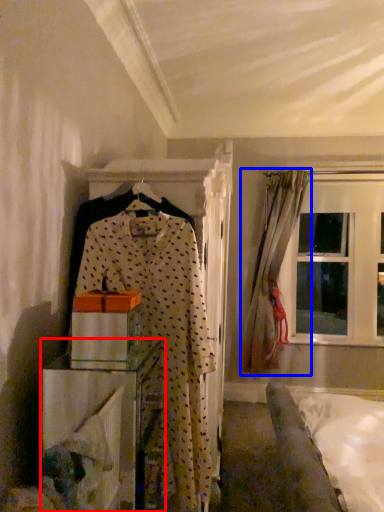
Question: Among these objects, which one is farthest to the camera, furniture (highlighted by a red box) or curtain (highlighted by a blue box)?

Choices:
 (A) furniture
 (B) curtain

Answer: (B)